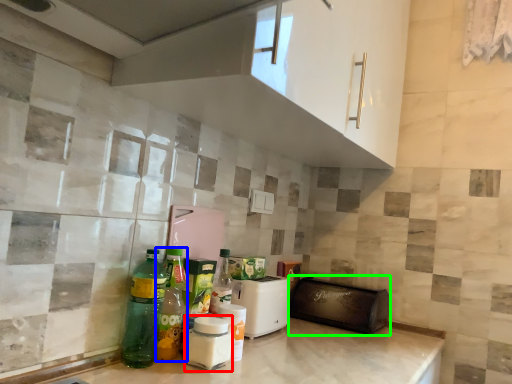
Question: Which object is the farthest from bottle (highlighted by a red box)? Choose among these: bottle (highlighted by a blue box) or appliance (highlighted by a green box).

Choices:
 (A) bottle
 (B) appliance

Answer: (B)